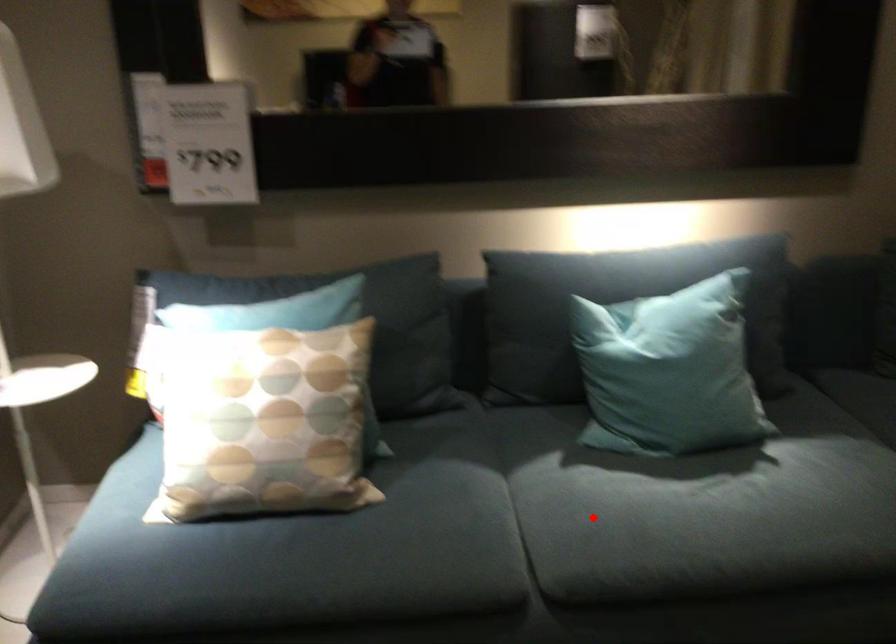
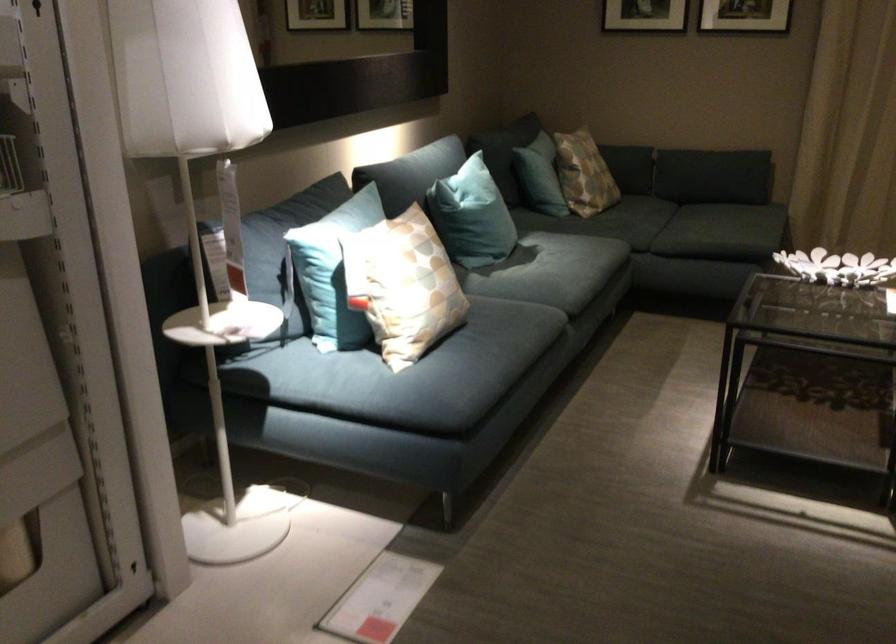
Question: I am providing you with two images of the same scene from different viewpoints. Given a red point in image1, look at the same physical point in image2. Is it:

Choices:
 (A) Closer to the viewpoint
 (B) Farther from the viewpoint

Answer: (B)